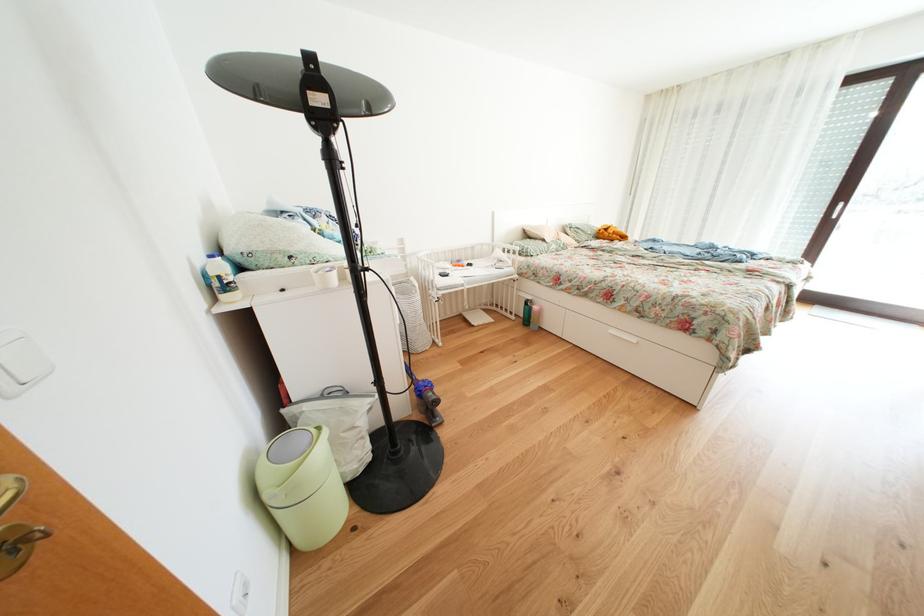
This screenshot has width=924, height=616. Find the location of `white and blue bottle`. white and blue bottle is located at coordinates (x=222, y=278).